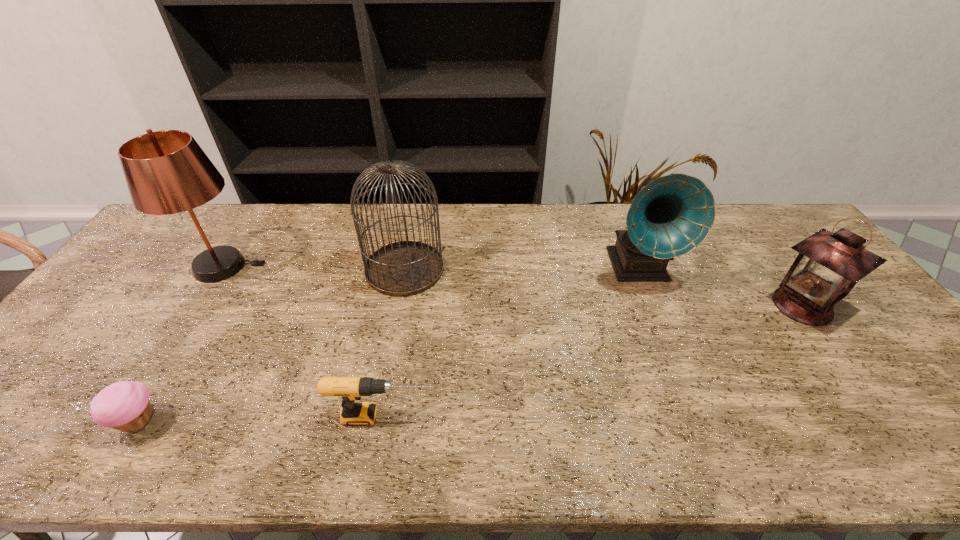
The width and height of the screenshot is (960, 540). I want to click on free space between the birdcage and the shortest object, so click(272, 346).

I want to click on empty space between the lampshade and the birdcage, so click(314, 268).

The image size is (960, 540). I want to click on vacant space in between the tallest object and the drill, so click(x=303, y=341).

The height and width of the screenshot is (540, 960). What are the coordinates of `blank region between the phonograph_record and the shortest object` in the screenshot? It's located at (389, 345).

Choose which object is the third nearest neighbor to the shortest object. Please provide its 2D coordinates. Your answer should be formatted as a tuple, i.e. [(x, y)], where the tuple contains the x and y coordinates of a point satisfying the conditions above.

[(405, 268)]

You are a GUI agent. You are given a task and a screenshot of the screen. Output one action in this format:
    pyautogui.click(x=<x>, y=<y>)
    Task: Click on the object that ranks as the second closest to the oil lamp
    
    Given the screenshot: What is the action you would take?
    pos(405,268)

Find the location of a particular element. The height and width of the screenshot is (540, 960). free location that satisfies the following two spatial constraints: 1. on the front-facing side of the birdcage; 2. on the left side of the tallest object is located at coordinates (222, 269).

Find the location of a particular element. vacant position in the image that satisfies the following two spatial constraints: 1. on the front-facing side of the cupcake; 2. on the left side of the tallest object is located at coordinates (124, 422).

This screenshot has width=960, height=540. What are the coordinates of `vacant space that satisfies the following two spatial constraints: 1. from the horn of the phonograph_record; 2. on the left side of the fourth tallest object` in the screenshot? It's located at (654, 306).

This screenshot has height=540, width=960. Identify the location of free space that satisfies the following two spatial constraints: 1. from the horn of the fifth object from left to right; 2. on the handle side of the drill. (697, 416).